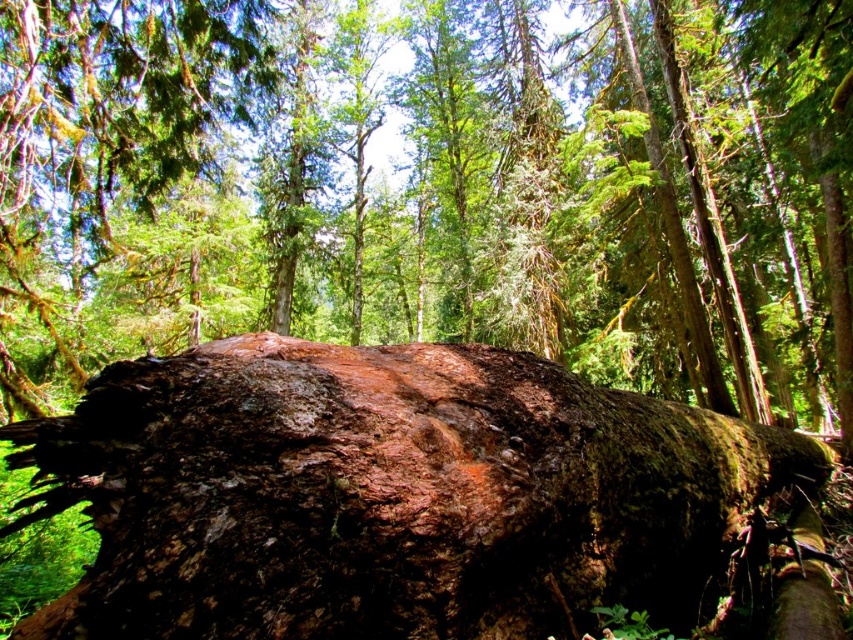
Question: Which point appears closest to the camera in this image?

Choices:
 (A) [340, 477]
 (B) [698, 28]

Answer: (A)

Question: Considering the relative positions of rough bark tree trunk at center and rusty metallic boulder at center in the image provided, where is rough bark tree trunk at center located with respect to rusty metallic boulder at center?

Choices:
 (A) right
 (B) left

Answer: (B)

Question: Can you confirm if rough bark tree trunk at center is wider than rusty metallic boulder at center?

Choices:
 (A) yes
 (B) no

Answer: (A)

Question: Is rough bark tree trunk at center to the left of rusty metallic boulder at center from the viewer's perspective?

Choices:
 (A) no
 (B) yes

Answer: (B)

Question: Which point is farther to the camera?

Choices:
 (A) rough bark tree trunk at center
 (B) rusty metallic boulder at center

Answer: (A)

Question: Which of the following is the farthest from the observer?

Choices:
 (A) (726, 396)
 (B) (357, 365)

Answer: (A)